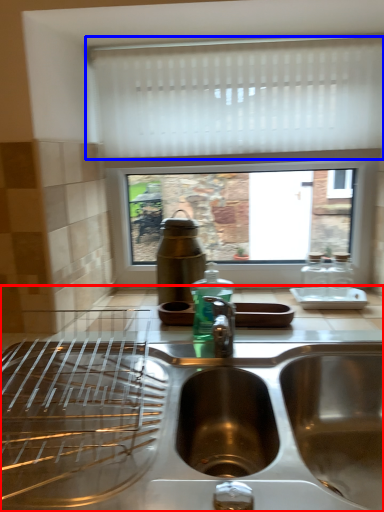
Question: Which object is closer to the camera taking this photo, countertop (highlighted by a red box) or curtain (highlighted by a blue box)?

Choices:
 (A) countertop
 (B) curtain

Answer: (A)